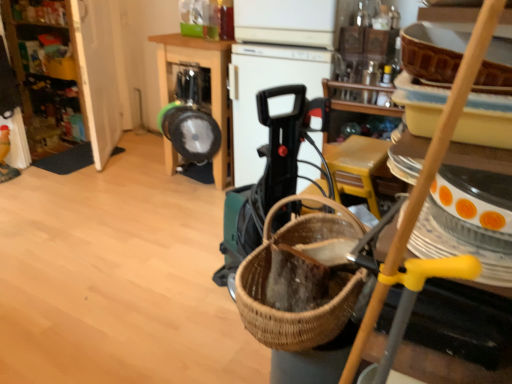
The image size is (512, 384). In order to click on blank area beneath metallic silver blender at center, which is the 1th appliance in left-to-right order (from a real-world perspective) in this screenshot , I will do `click(185, 189)`.